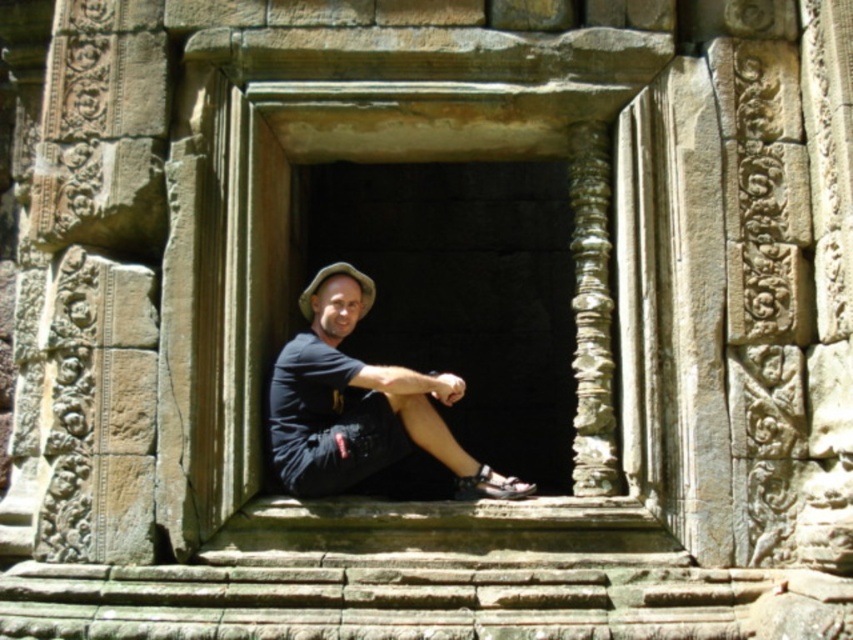
Is stone textured window at center wider than black matte shirt at center?

Yes, stone textured window at center is wider than black matte shirt at center.

Which is below, stone textured window at center or black matte shirt at center?

black matte shirt at center is below.

Which is behind, point (288, 307) or point (434, 372)?

Point (434, 372)

The height and width of the screenshot is (640, 853). In order to click on stone textured window at center in this screenshot , I will do `click(325, 161)`.